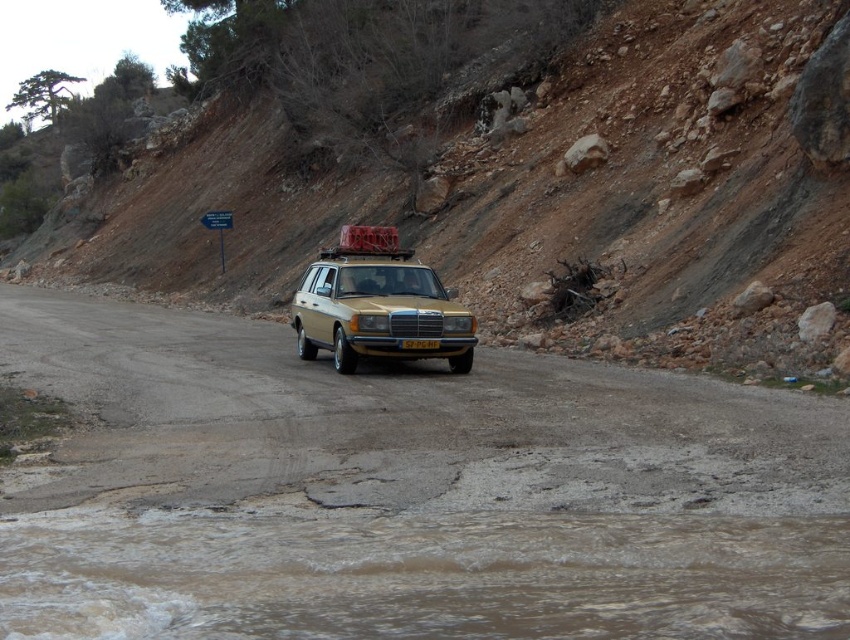
Consider the image. You are a driver in the gold metallic car at center. You need to pass under a low bridge that is exactly the height of the yellow plastic license plate at center. Will your car clear the bridge without hitting it?

The gold metallic car at center is much taller than the yellow plastic license plate at center. Therefore, the car will not clear the bridge and will hit it.

You are a geologist examining the image of the rugged, unpaved road. You notice the dull brown dirt at center. Based on its location, can you determine if it is on the steep hillside on the right or the road itself?

The dull brown dirt at center is located at point [658,198], which places it on the road itself rather than the steep hillside on the right.